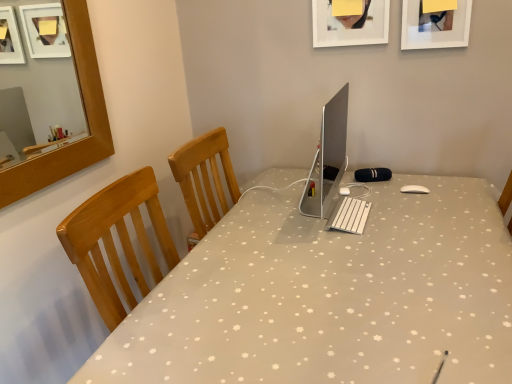
Find the location of `empty space that is to the right of silver metallic computer monitor at center`. empty space that is to the right of silver metallic computer monitor at center is located at coordinates point(402,205).